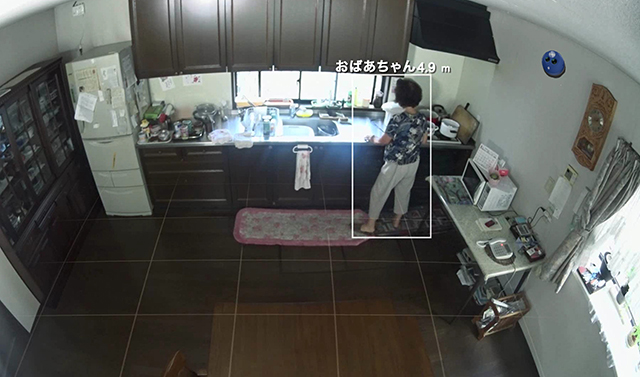
Find the location of a particular element. This screenshot has width=640, height=377. refrigerator is located at coordinates (116, 151).